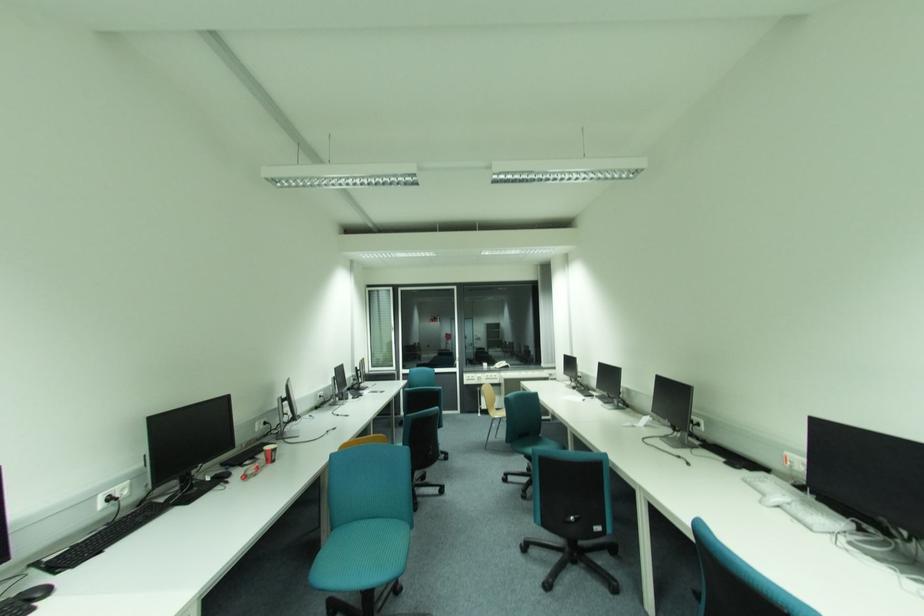
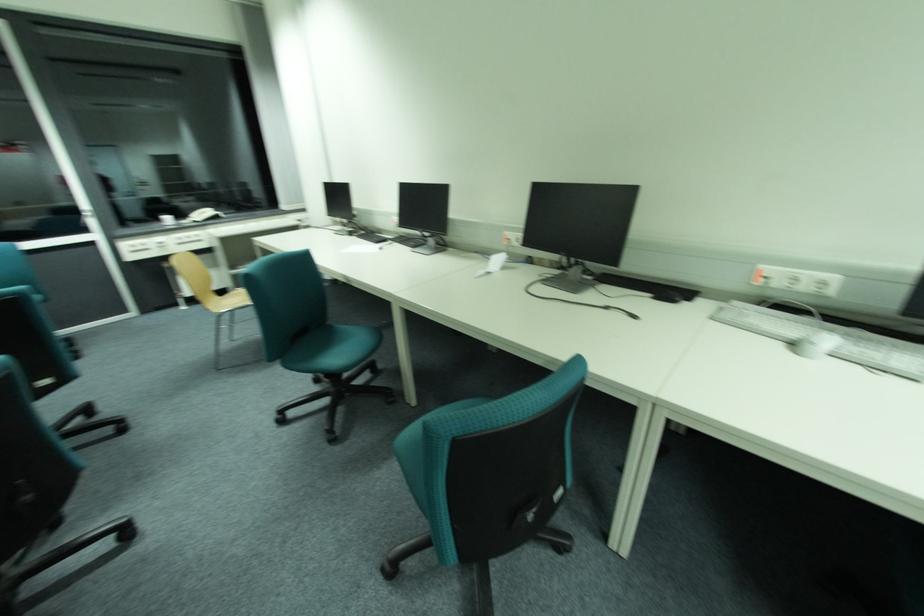
Where in the second image is the point corresponding to pixel 635 424 from the first image?

(487, 272)